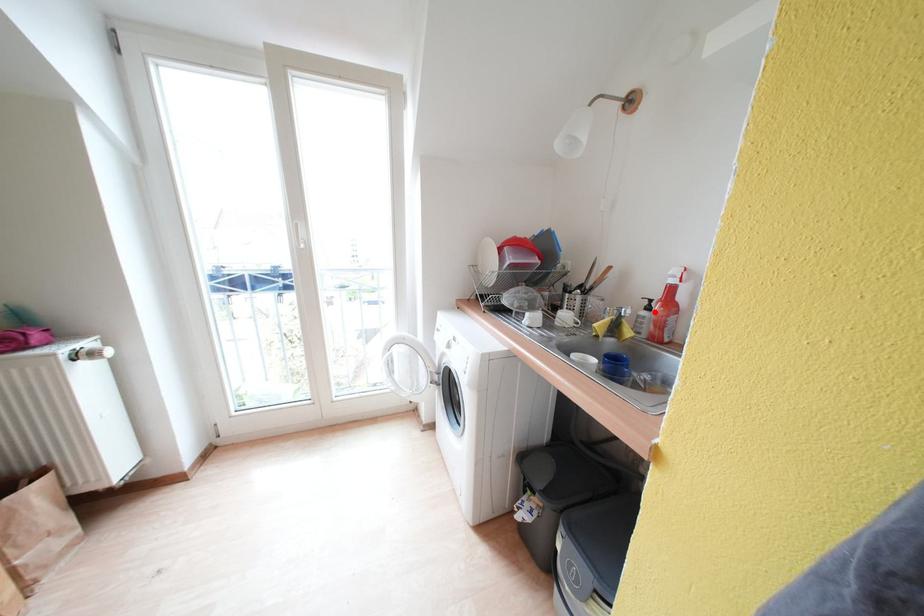
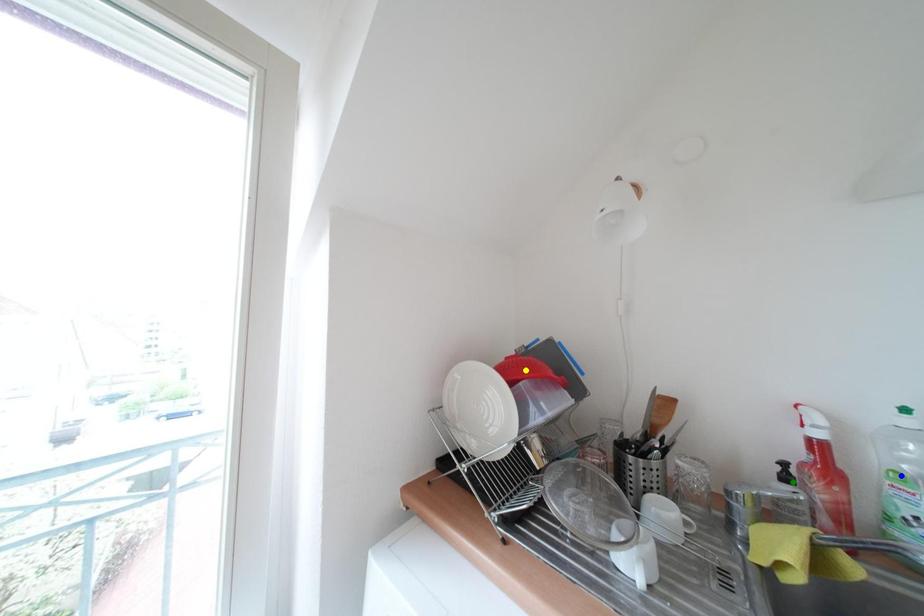
Question: I am providing you with two images of the same scene from different viewpoints. A red point is marked on the first image. You are given multiple points on the second image. Which spot in image 2 lines up with the point in image 1?

Choices:
 (A) yellow point
 (B) blue point
 (C) green point

Answer: (C)